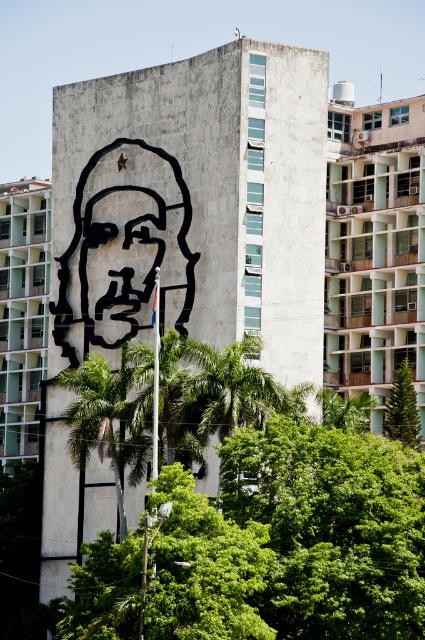
You are standing in front of the building and want to take a photo of the black matte portrait at center. If you look at the building from left to right, where would you aim your camera? Is it closer to the left edge, middle, or right edge of the building?

The black matte portrait at center is located at the middle of the building since its 2D coordinates are at point (122, 248), which places it centrally on the facade.

You are an art student analyzing the mural on the building. You observe the black matte portrait at center and the black matte face at center. Which object is placed higher on the mural?

The black matte portrait at center is positioned over the black matte face at center, meaning it is placed higher up on the mural.

You are an artist planning to paint a new mural on the building. The building has a black matte face at center and a green leafy tree at center. Which object should you consider in terms of size when ensuring your new design fits the space?

The black matte face at center has a larger width than the green leafy tree at center, so you should consider the size of the black matte face at center to ensure your new design fits appropriately.